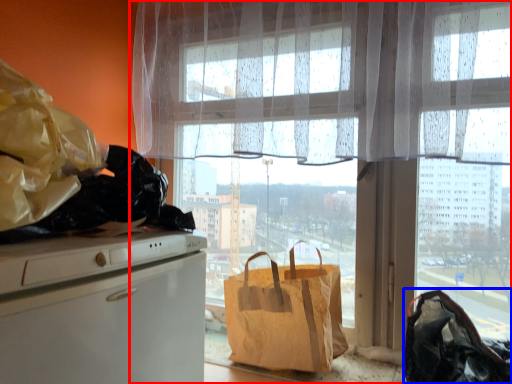
Question: Which object appears closest to the camera in this image, window (highlighted by a red box) or handbag (highlighted by a blue box)?

Choices:
 (A) window
 (B) handbag

Answer: (B)